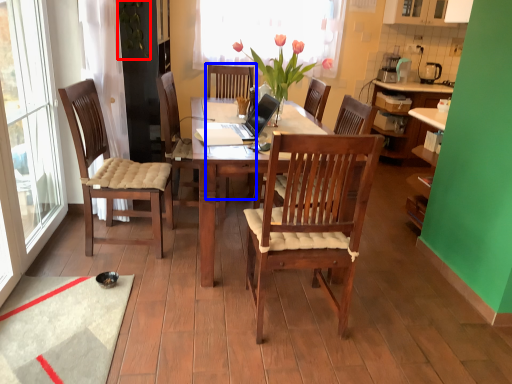
Question: Among these objects, which one is farthest to the camera, plant (highlighted by a red box) or armchair (highlighted by a blue box)?

Choices:
 (A) plant
 (B) armchair

Answer: (B)